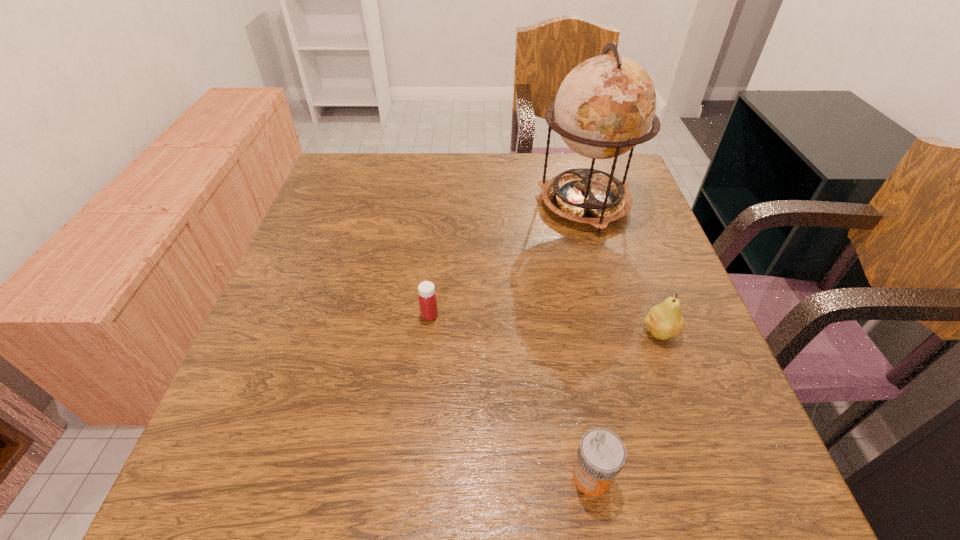
The width and height of the screenshot is (960, 540). In order to click on free spot between the tallest object and the nearest object in this screenshot , I will do `click(588, 341)`.

Identify the location of free space between the right medicine and the leftmost object. (511, 396).

Find the location of `blank region between the nearest object and the pear`. blank region between the nearest object and the pear is located at coordinates (625, 404).

Where is `free space between the leftmost object and the nearer medicine`? The height and width of the screenshot is (540, 960). free space between the leftmost object and the nearer medicine is located at coordinates (511, 396).

Locate an element on the screen. vacant space in between the pear and the nearer medicine is located at coordinates (625, 404).

The image size is (960, 540). Identify the location of object that is the second closest to the pear. (605, 106).

Image resolution: width=960 pixels, height=540 pixels. I want to click on object that is the closest to the right medicine, so click(665, 320).

The width and height of the screenshot is (960, 540). Find the location of `vacant position in the image that satisfies the following two spatial constraints: 1. at the center of the tallest object; 2. on the left side of the pear`. vacant position in the image that satisfies the following two spatial constraints: 1. at the center of the tallest object; 2. on the left side of the pear is located at coordinates (621, 332).

The height and width of the screenshot is (540, 960). I want to click on free space that satisfies the following two spatial constraints: 1. on the front side of the pear; 2. on the left side of the left medicine, so click(x=428, y=332).